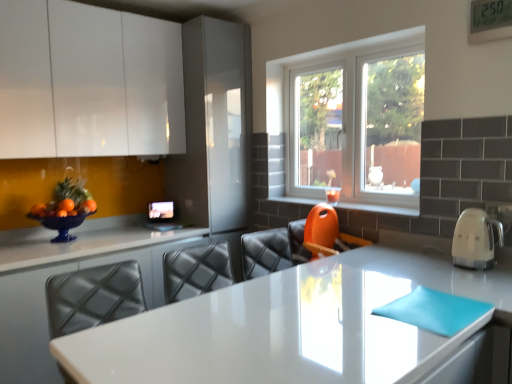
Question: From a real-world perspective, is white glossy kettle at right positioned above or below clear glass window at center?

Choices:
 (A) above
 (B) below

Answer: (B)

Question: Is white glossy kettle at right in front of or behind clear glass window at center in the image?

Choices:
 (A) behind
 (B) front

Answer: (B)

Question: Estimate the real-world distances between objects in this image. Which object is farther from the white glossy kettle at right?

Choices:
 (A) white glossy countertop at center, which ranks as the first countertop in left-to-right order
 (B) white glossy countertop at center, which is the 2th countertop in left-to-right order
 (C) clear glass window at center
 (D) white glossy cabinet at upper left
 (E) orange plastic chair at lower center

Answer: (D)

Question: Based on their relative distances, which object is nearer to the white glossy countertop at center, acting as the 1th countertop starting from the right?

Choices:
 (A) white glossy countertop at center, the 2th countertop positioned from the right
 (B) white glossy cabinet at upper left
 (C) orange plastic chair at lower center
 (D) white glossy kettle at right
 (E) clear glass window at center

Answer: (D)